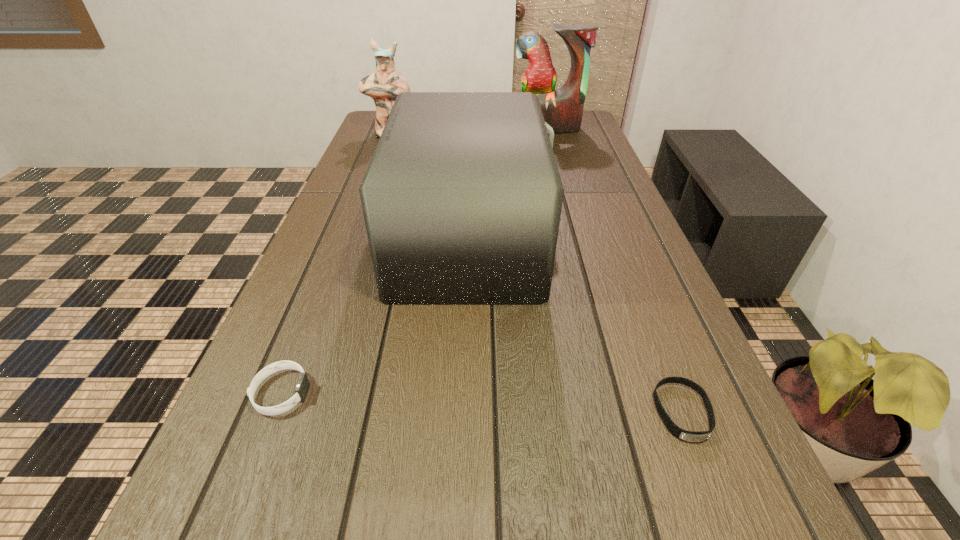
Where is `free region located on the outer surface of the second shortest object`? free region located on the outer surface of the second shortest object is located at coordinates (468, 393).

Where is `parrot located at the far edge`? This screenshot has height=540, width=960. parrot located at the far edge is located at coordinates (562, 109).

Identify the location of figurine at the far edge. The width and height of the screenshot is (960, 540). (386, 83).

Locate an element on the screen. The image size is (960, 540). figurine that is at the left edge is located at coordinates (386, 83).

Find the location of `wristband situated at the left edge`. wristband situated at the left edge is located at coordinates (303, 384).

The height and width of the screenshot is (540, 960). Identify the location of parrot that is at the right edge. (562, 109).

Where is `wristband that is positioned at the right edge`? wristband that is positioned at the right edge is located at coordinates (691, 436).

Where is `object at the far left corner`? This screenshot has width=960, height=540. object at the far left corner is located at coordinates (386, 83).

You are a GUI agent. You are given a task and a screenshot of the screen. Output one action in this format:
    pyautogui.click(x=<x>, y=<y>)
    Task: Click on the object present at the far right corner
    This screenshot has width=960, height=540.
    Given the screenshot: What is the action you would take?
    pyautogui.click(x=562, y=109)

Locate an element on the screen. Image resolution: width=960 pixels, height=540 pixels. vacant space at the left edge of the desktop is located at coordinates 339,191.